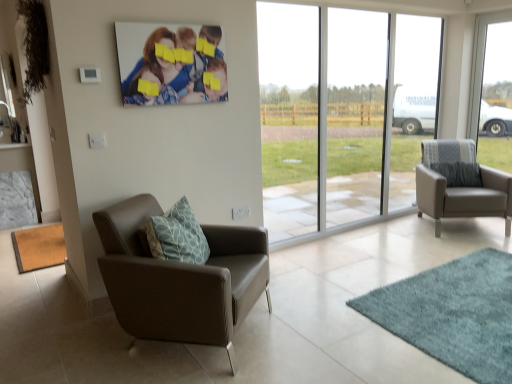
The width and height of the screenshot is (512, 384). I want to click on empty space that is to the right of brown leather chair at left, the second chair in the back-to-front sequence, so click(310, 324).